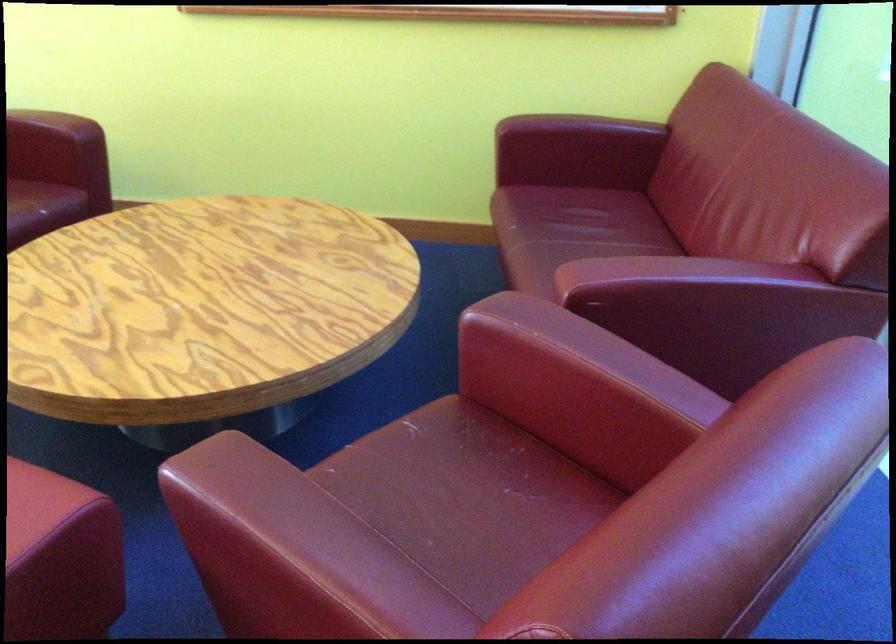
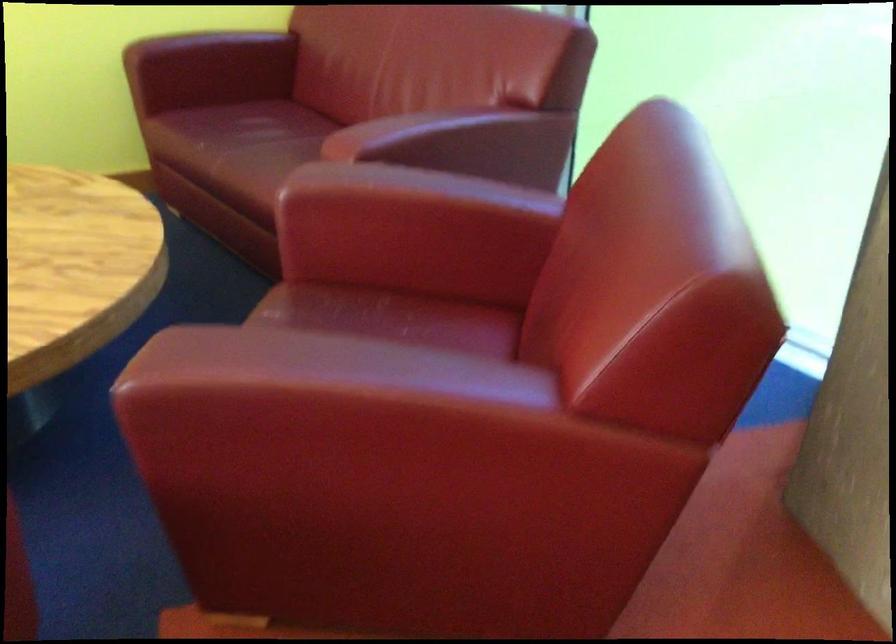
In the second image, find the point that corresponds to the point at 182,480 in the first image.

(177, 386)